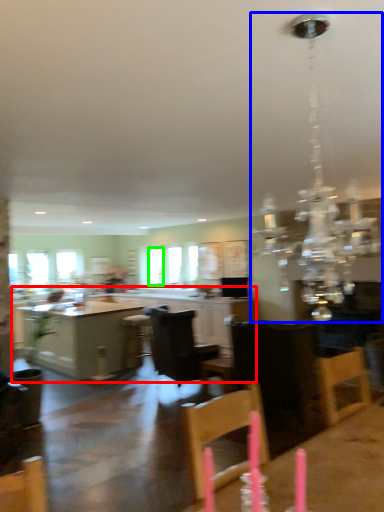
Question: Considering the real-world distances, which object is closest to cabinetry (highlighted by a red box)? light fixture (highlighted by a blue box) or window (highlighted by a green box).

Choices:
 (A) light fixture
 (B) window

Answer: (A)